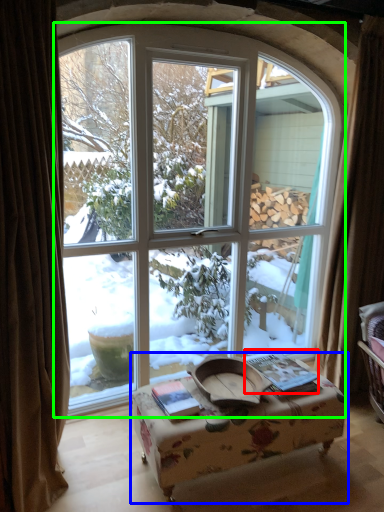
Question: Which is nearer to the book (highlighted by a red box)? table (highlighted by a blue box) or window (highlighted by a green box).

Choices:
 (A) table
 (B) window

Answer: (A)